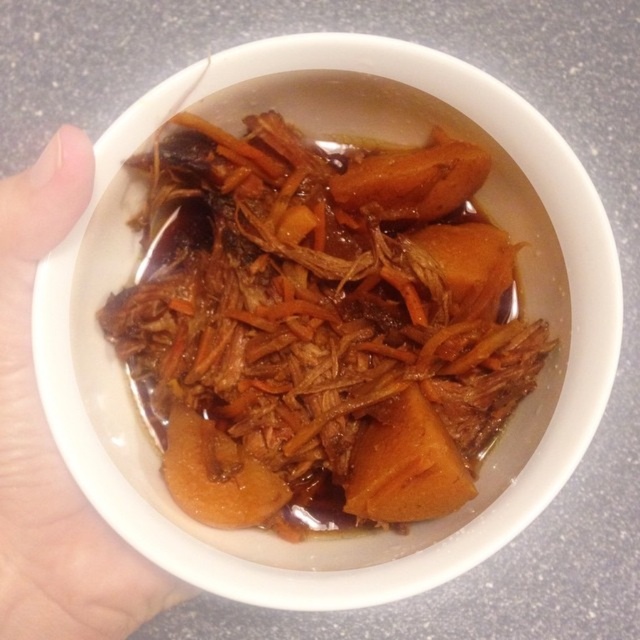
Between point (269, 451) and point (52, 212), which one is positioned in front?

Positioned in front is point (52, 212).

What do you see at coordinates (321, 326) in the screenshot?
I see `brown glossy shredded meat at center` at bounding box center [321, 326].

Where is `brown glossy shredded meat at center`? brown glossy shredded meat at center is located at coordinates (321, 326).

Find the location of a particular element. The width and height of the screenshot is (640, 640). brown glossy shredded meat at center is located at coordinates (321, 326).